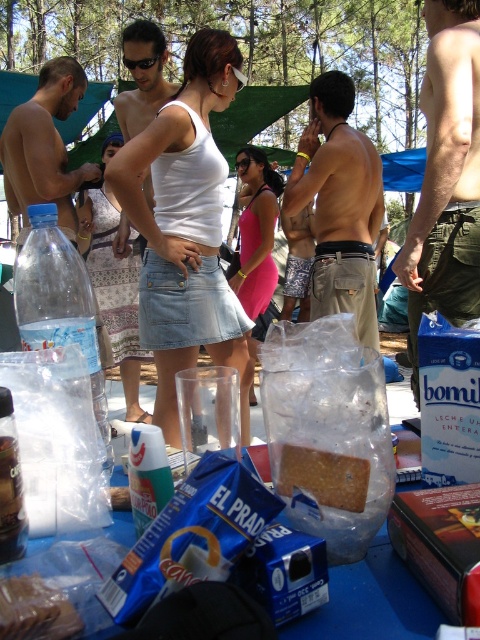
You are standing at the position of point [20,129] and want to reach the picnic area located at point [170,403]. Is there any obstruction between you and your destination?

Point [170,403] is in front of point [20,129], so there is no obstruction between them.

You are organizing a picnic basket and need to decide which item to place first. Since the green canvas shorts at center and the golden textured cracker at center are both at the center, which one can you place first if you want to fit both items into the basket without overlapping?

The green canvas shorts at center is wider than the golden textured cracker at center, so you should place the wider green canvas shorts at center first to ensure both items fit without overlapping.

You are at a beach gathering and see two people wearing different colored tops. The first person is wearing a white matte tank top at center and the second is wearing a matte black torso at left. Which person is taller?

The white matte tank top at center has a greater height compared to matte black torso at left, so the person wearing the white matte tank top at center is taller.